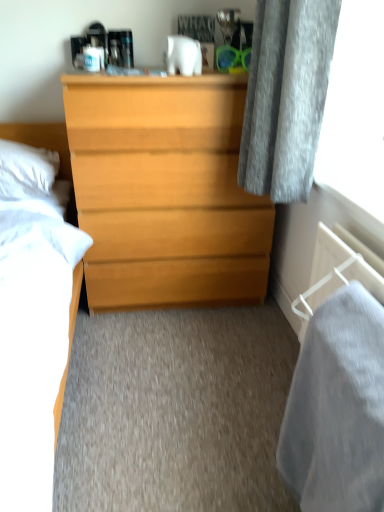
Question: Is light wood chest of drawers at center spatially inside white soft pillow at left, or outside of it?

Choices:
 (A) inside
 (B) outside

Answer: (B)

Question: Is light wood chest of drawers at center in front of or behind white soft pillow at left in the image?

Choices:
 (A) behind
 (B) front

Answer: (B)

Question: Considering the real-world distances, which object is closest to the light wood chest of drawers at center?

Choices:
 (A) gray soft fabric at lower right
 (B) white soft pillow at left

Answer: (B)

Question: Which is nearer to the white soft pillow at left?

Choices:
 (A) light wood chest of drawers at center
 (B) gray soft fabric at lower right

Answer: (A)